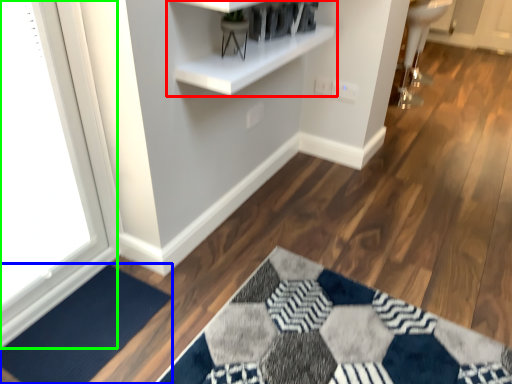
Question: Which object is the farthest from shelf (highlighted by a red box)? Choose among these: doormat (highlighted by a blue box) or window (highlighted by a green box).

Choices:
 (A) doormat
 (B) window

Answer: (A)